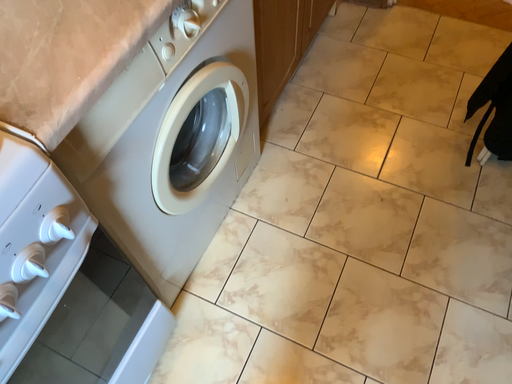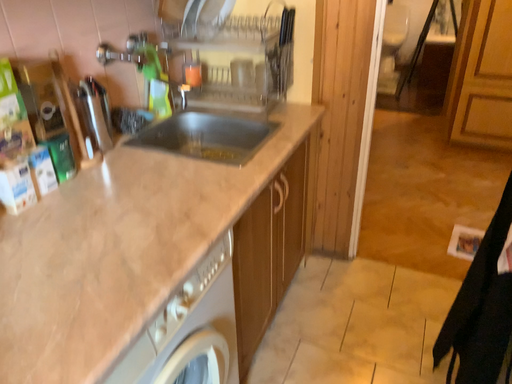
Question: How did the camera likely rotate when shooting the video?

Choices:
 (A) rotated upward
 (B) rotated downward

Answer: (A)